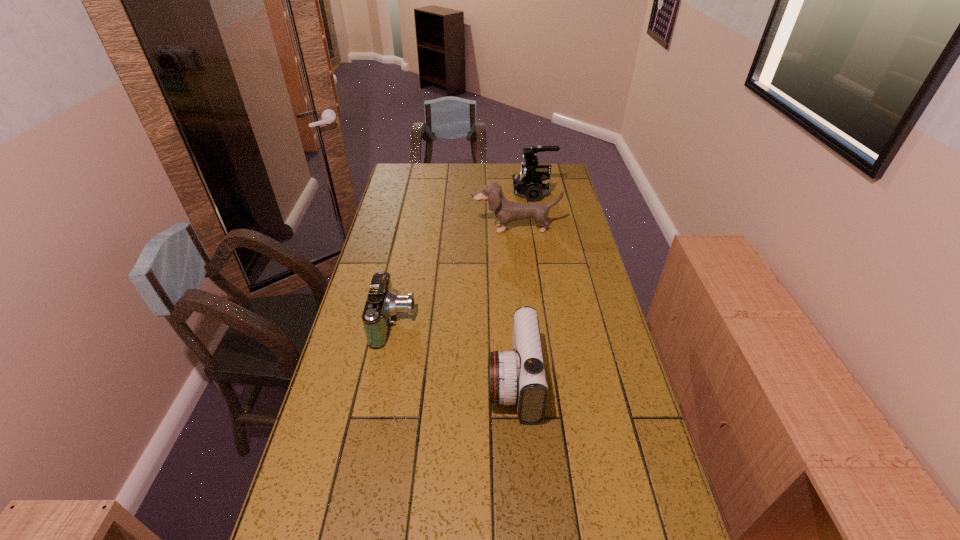
Identify the location of the farthest object. The image size is (960, 540). (532, 183).

Where is `the tallest camcorder`? the tallest camcorder is located at coordinates (532, 183).

Locate an element on the screen. The image size is (960, 540). puppy is located at coordinates (506, 211).

Where is `the second tallest camcorder`? The image size is (960, 540). the second tallest camcorder is located at coordinates (518, 377).

In order to click on the leftmost object in this screenshot , I will do `click(382, 303)`.

Image resolution: width=960 pixels, height=540 pixels. Find the location of `the shortest object`. the shortest object is located at coordinates (382, 303).

Identify the location of free space located 0.320m on the lens mount of the farthest camcorder. (442, 193).

The image size is (960, 540). Identify the location of vacant space situated 0.400m on the lens mount of the farthest camcorder. (424, 193).

Locate an element on the screen. The height and width of the screenshot is (540, 960). vacant space located on the lens mount of the farthest camcorder is located at coordinates (433, 193).

You are a GUI agent. You are given a task and a screenshot of the screen. Output one action in this format:
    pyautogui.click(x=<x>, y=<y>)
    Task: Click on the vacant region located 0.260m at the face of the puppy
    
    Given the screenshot: What is the action you would take?
    pyautogui.click(x=520, y=278)